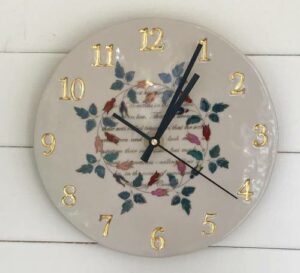
At what (x,y) coordinates should I click in order to perform the action: click on clock. Please return your answer as a coordinate pair (x, y). Looking at the image, I should click on (177, 47).